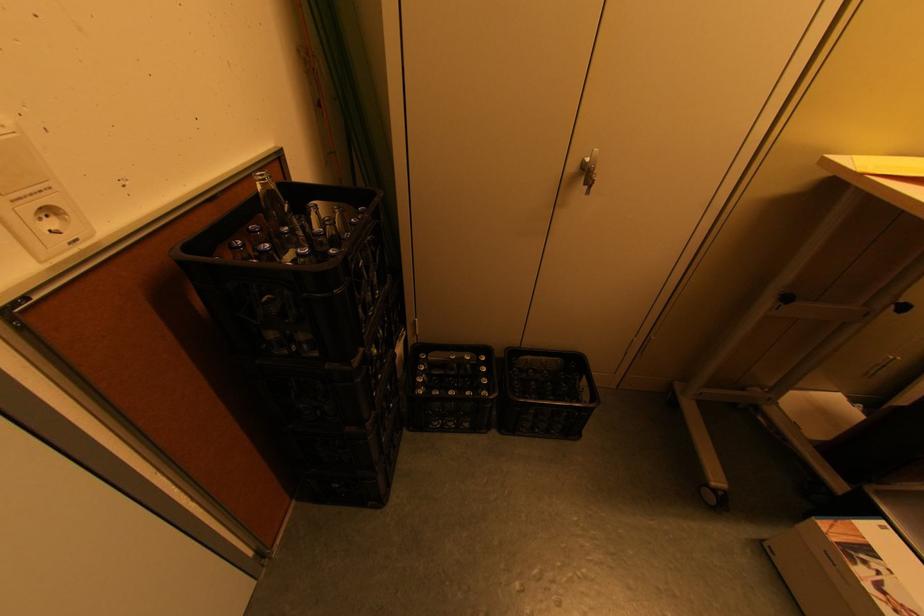
What are the coordinates of `cabinet handle` in the screenshot? It's located at [x=590, y=161].